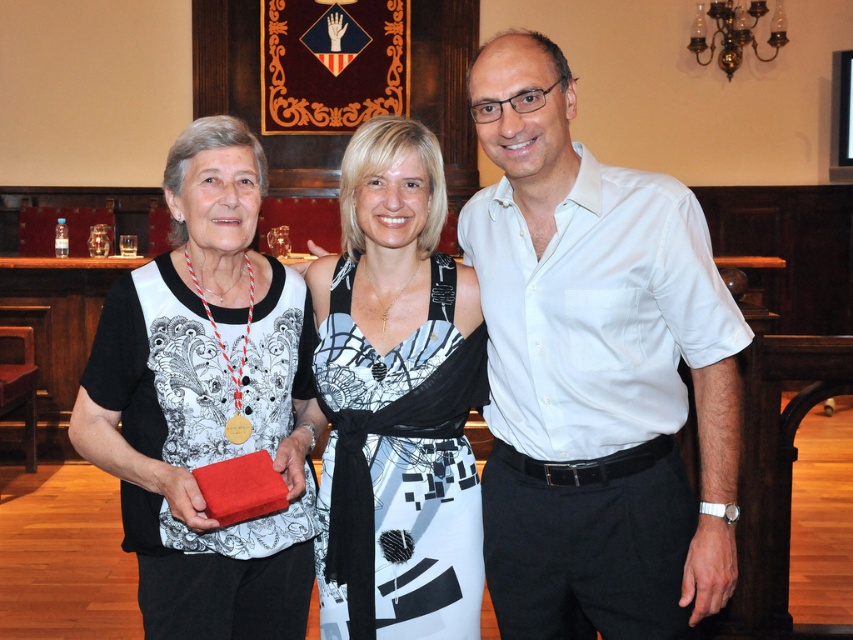
You are a photographer at an event and need to ensure that both the white cotton shirt at center and the printed fabric dress at center are visible in the photo. Given their sizes, which one might you need to position closer to the camera to ensure both are clearly visible?

The white cotton shirt at center is larger in size than the printed fabric dress at center. To ensure both are clearly visible, position the printed fabric dress at center closer to the camera since it is smaller and might need to be nearer for clarity.

You are standing in front of the three people in the image. You want to place a small gift on the table between them. The table is located at point (381, 218). However, there is an obstacle at point (688, 502). Can you reach the table without moving the obstacle?

Point (688, 502) is further to the camera than point (381, 218). Therefore, the obstacle at point (688, 502) is closer to you, blocking your path to the table at point (381, 218). You cannot reach the table without moving the obstacle.